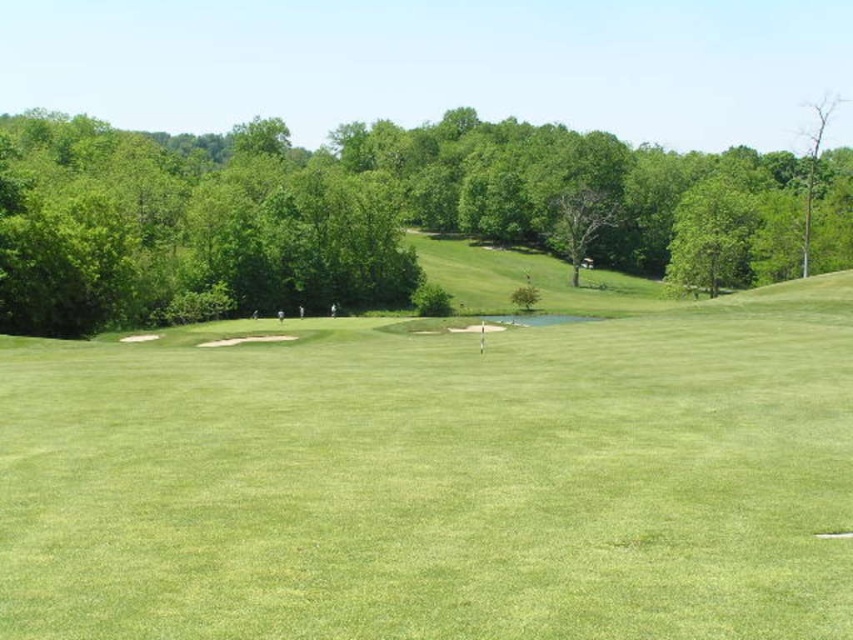
You are standing at the point with coordinates point (437, 480). Looking around, you see the green grassy field at center. What is the name of the area you are currently standing on?

The point (437, 480) corresponds to the green grassy field at center, so you are standing on the green grassy field at center.

Consider the image. You are standing on the golf course and want to hit a ball towards the flag. Which object, the green grassy field at center or the green leafy tree at upper center, is closer to you?

The green grassy field at center is closer to the viewer than the green leafy tree at upper center, so the green grassy field at center is closer to you.